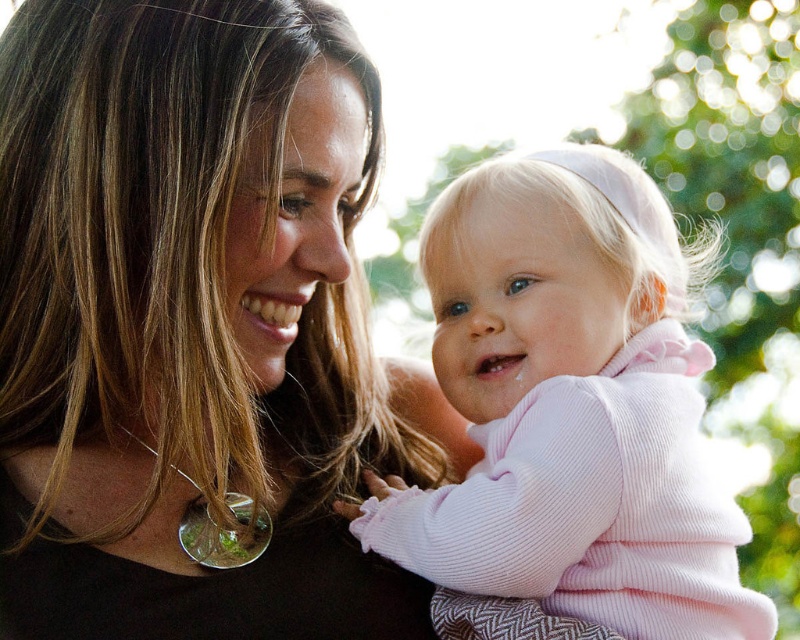
Consider the image. You are a photographer trying to capture a closeup of the matte black shirt at center and the pink corduroy baby at center. Which object should you focus on first if you want to ensure both are in focus?

The matte black shirt at center is above the pink corduroy baby at center, so you should focus on the pink corduroy baby at center first to ensure both are in focus.